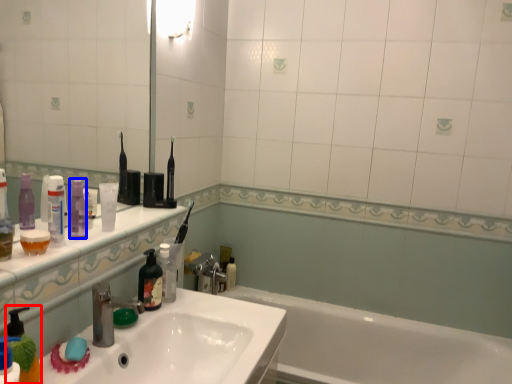
Question: Which object is closer to the camera taking this photo, soap dispenser (highlighted by a red box) or toiletry (highlighted by a blue box)?

Choices:
 (A) soap dispenser
 (B) toiletry

Answer: (A)